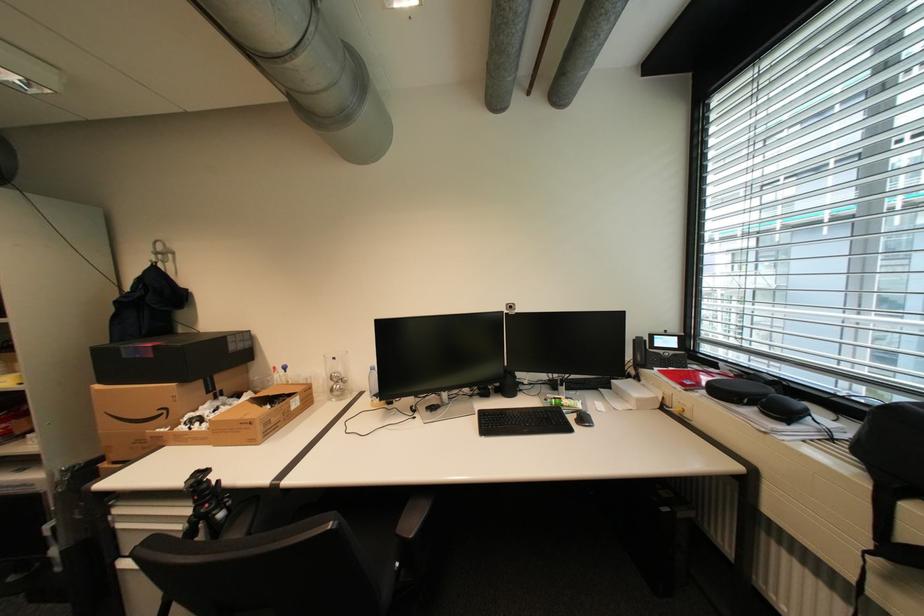
In order to click on metal wall hook in this screenshot , I will do `click(161, 249)`.